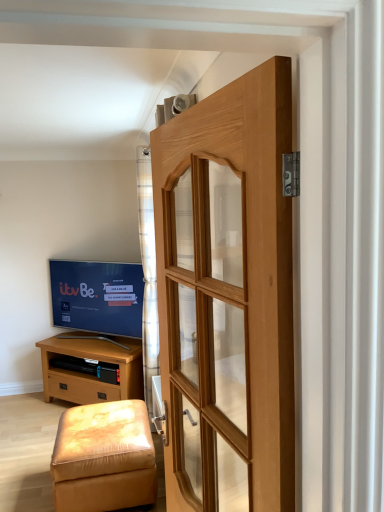
This screenshot has height=512, width=384. Describe the element at coordinates (92, 375) in the screenshot. I see `light brown wood chest of drawers at lower left` at that location.

Locate an element on the screen. leather-like beige stool at lower left is located at coordinates (104, 458).

Image resolution: width=384 pixels, height=512 pixels. What do you see at coordinates (228, 292) in the screenshot?
I see `natural wood door at center` at bounding box center [228, 292].

Image resolution: width=384 pixels, height=512 pixels. Find the location of `natural wood door at center`. natural wood door at center is located at coordinates click(228, 292).

Identify the location of plaid fabric curtain at center. (148, 275).

Is light brown wood chest of drawers at lower left outside of natural wood door at center?

That's correct, light brown wood chest of drawers at lower left is outside of natural wood door at center.

Between light brown wood chest of drawers at lower left and natural wood door at center, which one is positioned behind?

light brown wood chest of drawers at lower left is further from the camera.

From a real-world perspective, is light brown wood chest of drawers at lower left physically above natural wood door at center?

No, from a real-world perspective, light brown wood chest of drawers at lower left is not on top of natural wood door at center.

Which object is positioned more to the right, light brown wood chest of drawers at lower left or natural wood door at center?

Positioned to the right is natural wood door at center.

Considering the sizes of leather-like beige stool at lower left and light brown wood chest of drawers at lower left in the image, is leather-like beige stool at lower left taller or shorter than light brown wood chest of drawers at lower left?

leather-like beige stool at lower left is shorter than light brown wood chest of drawers at lower left.

Considering the relative sizes of leather-like beige stool at lower left and light brown wood chest of drawers at lower left in the image provided, is leather-like beige stool at lower left thinner than light brown wood chest of drawers at lower left?

No.

Is leather-like beige stool at lower left located outside light brown wood chest of drawers at lower left?

That's correct, leather-like beige stool at lower left is outside of light brown wood chest of drawers at lower left.

From the image's perspective, who appears lower, leather-like beige stool at lower left or light brown wood chest of drawers at lower left?

leather-like beige stool at lower left is shown below in the image.

Considering the positions of points (120, 448) and (55, 320), is point (120, 448) farther from camera compared to point (55, 320)?

No.

Looking at this image, does leather-like beige stool at lower left contain matte black tv at left?

No, leather-like beige stool at lower left does not contain matte black tv at left.

How many degrees apart are the facing directions of leather-like beige stool at lower left and matte black tv at left?

The angular difference between leather-like beige stool at lower left and matte black tv at left is 48.8 degrees.

Who is bigger, leather-like beige stool at lower left or matte black tv at left?

Bigger between the two is leather-like beige stool at lower left.

From the picture: From the image's perspective, is natural wood door at center under matte black tv at left?

Incorrect, from the image's perspective, natural wood door at center is higher than matte black tv at left.

Is natural wood door at center at the left side of matte black tv at left?

No, natural wood door at center is not to the left of matte black tv at left.

From a real-world perspective, does natural wood door at center sit lower than matte black tv at left?

No.

From a real-world perspective, which is physically above, light brown wood chest of drawers at lower left or leather-like beige stool at lower left?

light brown wood chest of drawers at lower left.

Is light brown wood chest of drawers at lower left thinner than leather-like beige stool at lower left?

Correct, the width of light brown wood chest of drawers at lower left is less than that of leather-like beige stool at lower left.

Would you say light brown wood chest of drawers at lower left contains leather-like beige stool at lower left?

No, light brown wood chest of drawers at lower left does not contain leather-like beige stool at lower left.

Based on the photo, is plaid fabric curtain at center directly adjacent to light brown wood chest of drawers at lower left?

No, plaid fabric curtain at center is not next to light brown wood chest of drawers at lower left.

Does point (156, 336) appear closer or farther from the camera than point (65, 374)?

Point (156, 336) appears to be closer to the viewer than point (65, 374).

From the image's perspective, between plaid fabric curtain at center and light brown wood chest of drawers at lower left, which one is located above?

plaid fabric curtain at center is shown above in the image.

Is plaid fabric curtain at center positioned behind light brown wood chest of drawers at lower left?

No, plaid fabric curtain at center is in front of light brown wood chest of drawers at lower left.

Identify the location of curtain in front of the matte black tv at left. (148, 275).

Is matte black tv at left at the right side of plaid fabric curtain at center?

No, matte black tv at left is not to the right of plaid fabric curtain at center.

Could you tell me if matte black tv at left is turned towards plaid fabric curtain at center?

No, matte black tv at left is not turned towards plaid fabric curtain at center.

Where is `door that appears above the light brown wood chest of drawers at lower left (from a real-world perspective)`? The width and height of the screenshot is (384, 512). door that appears above the light brown wood chest of drawers at lower left (from a real-world perspective) is located at coordinates (228, 292).

Locate an element on the screen. stool below the light brown wood chest of drawers at lower left (from the image's perspective) is located at coordinates (104, 458).

From the image, which object appears to be nearer to plaid fabric curtain at center, natural wood door at center or light brown wood chest of drawers at lower left?

Based on the image, light brown wood chest of drawers at lower left appears to be nearer to plaid fabric curtain at center.

When comparing their distances from leather-like beige stool at lower left, does natural wood door at center or light brown wood chest of drawers at lower left seem closer?

Among the two, light brown wood chest of drawers at lower left is located nearer to leather-like beige stool at lower left.

Looking at the image, which one is located further to leather-like beige stool at lower left, plaid fabric curtain at center or matte black tv at left?

The object further to leather-like beige stool at lower left is matte black tv at left.

From the image, which object appears to be nearer to matte black tv at left, plaid fabric curtain at center or leather-like beige stool at lower left?

plaid fabric curtain at center is positioned closer to the anchor matte black tv at left.

From the image, which object appears to be nearer to light brown wood chest of drawers at lower left, plaid fabric curtain at center or natural wood door at center?

Among the two, plaid fabric curtain at center is located nearer to light brown wood chest of drawers at lower left.

Looking at the image, which one is located closer to light brown wood chest of drawers at lower left, natural wood door at center or plaid fabric curtain at center?

Based on the image, plaid fabric curtain at center appears to be nearer to light brown wood chest of drawers at lower left.

Considering their positions, is leather-like beige stool at lower left positioned further to natural wood door at center than matte black tv at left?

Based on the image, matte black tv at left appears to be further to natural wood door at center.

Estimate the real-world distances between objects in this image. Which object is closer to matte black tv at left, leather-like beige stool at lower left or natural wood door at center?

The object closer to matte black tv at left is leather-like beige stool at lower left.

Where is `television between plaid fabric curtain at center and light brown wood chest of drawers at lower left from top to bottom`? The image size is (384, 512). television between plaid fabric curtain at center and light brown wood chest of drawers at lower left from top to bottom is located at coordinates (97, 297).

Where is `curtain between natural wood door at center and matte black tv at left from front to back`? Image resolution: width=384 pixels, height=512 pixels. curtain between natural wood door at center and matte black tv at left from front to back is located at coordinates (148, 275).

Locate an element on the screen. This screenshot has width=384, height=512. curtain between leather-like beige stool at lower left and light brown wood chest of drawers at lower left along the z-axis is located at coordinates (148, 275).

Identify the location of curtain between leather-like beige stool at lower left and matte black tv at left in the front-back direction. Image resolution: width=384 pixels, height=512 pixels. (148, 275).